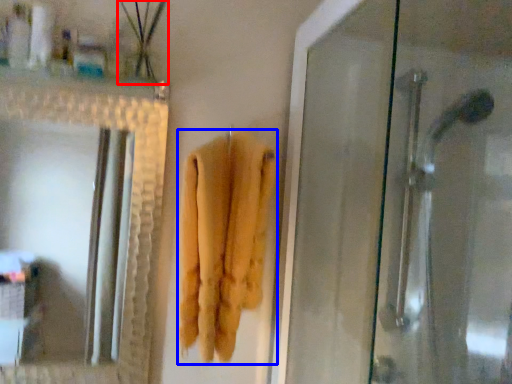
Question: Which of the following is the closest to the observer, plant (highlighted by a red box) or towel (highlighted by a blue box)?

Choices:
 (A) plant
 (B) towel

Answer: (B)